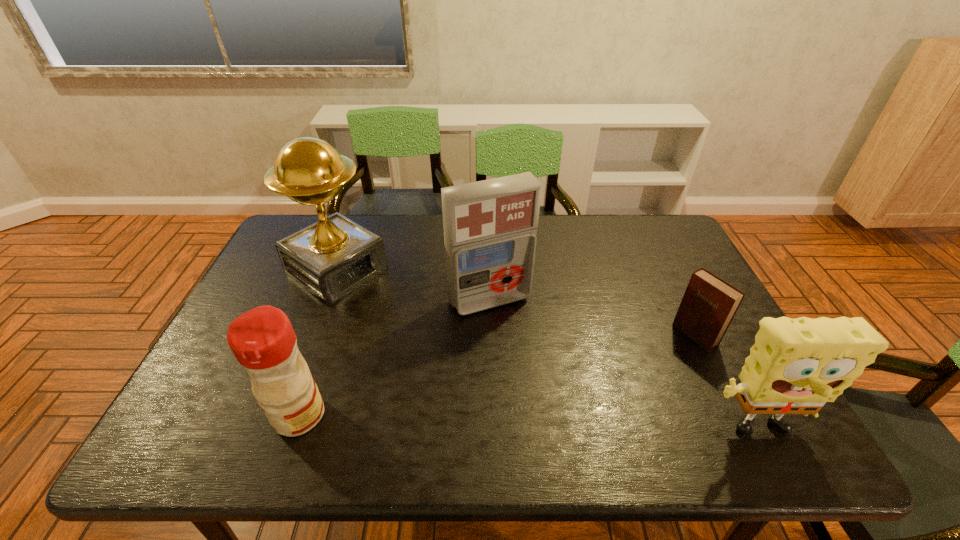
The height and width of the screenshot is (540, 960). In order to click on vacant space located on the front cover of the diary in this screenshot , I will do `click(608, 393)`.

Find the location of a particular element. Image resolution: width=960 pixels, height=540 pixels. vacant space located 0.160m on the front cover of the diary is located at coordinates (640, 372).

Find the location of `free space located 0.310m on the front cover of the diary`. free space located 0.310m on the front cover of the diary is located at coordinates (595, 401).

The width and height of the screenshot is (960, 540). Find the location of `vacant position located 0.140m on the front-facing side of the award`. vacant position located 0.140m on the front-facing side of the award is located at coordinates (402, 316).

The image size is (960, 540). Identify the location of free region located on the front-facing side of the award. (413, 323).

Where is `free point located on the front-facing side of the award`? free point located on the front-facing side of the award is located at coordinates (388, 306).

Locate an element on the screen. object located at the far edge is located at coordinates (331, 258).

The width and height of the screenshot is (960, 540). In order to click on condiment located at the near edge in this screenshot , I will do `click(262, 339)`.

Where is `sponge positioned at the near edge`? sponge positioned at the near edge is located at coordinates (796, 365).

Locate an element on the screen. The height and width of the screenshot is (540, 960). object present at the left edge is located at coordinates (331, 258).